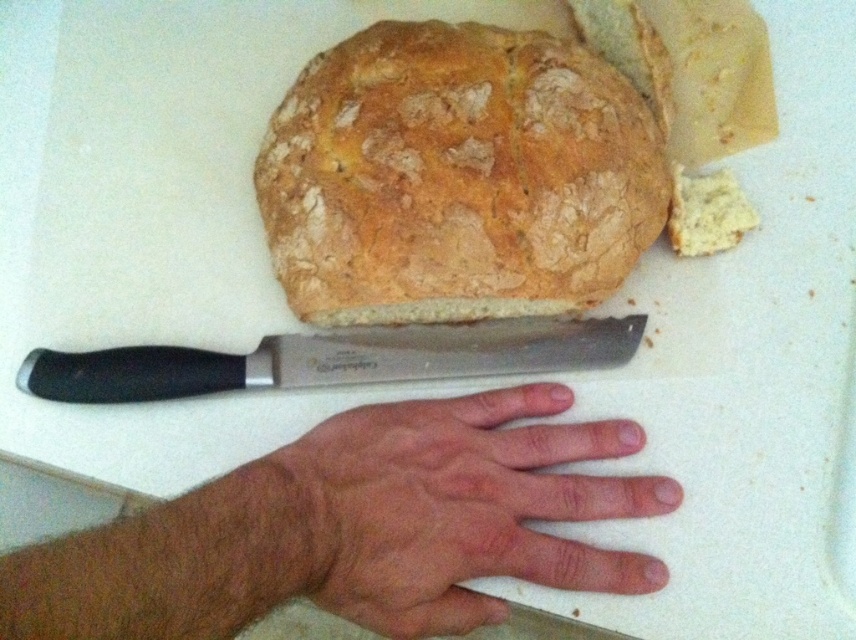
Which is behind, point (465, 182) or point (504, 326)?

Point (504, 326)

Between golden brown crusty bread at upper center and black plastic handle knife at center, which one is positioned lower?

Positioned lower is black plastic handle knife at center.

You are a GUI agent. You are given a task and a screenshot of the screen. Output one action in this format:
    pyautogui.click(x=<x>, y=<y>)
    Task: Click on the golden brown crusty bread at upper center
    
    Given the screenshot: What is the action you would take?
    pyautogui.click(x=456, y=177)

Based on the photo, does golden brown crusty bread at upper center appear on the left side of dry skin at center?

Indeed, golden brown crusty bread at upper center is positioned on the left side of dry skin at center.

Does golden brown crusty bread at upper center appear on the right side of dry skin at center?

Incorrect, golden brown crusty bread at upper center is not on the right side of dry skin at center.

What do you see at coordinates (456, 177) in the screenshot? I see `golden brown crusty bread at upper center` at bounding box center [456, 177].

You are a GUI agent. You are given a task and a screenshot of the screen. Output one action in this format:
    pyautogui.click(x=<x>, y=<y>)
    Task: Click on the golden brown crusty bread at upper center
    
    Given the screenshot: What is the action you would take?
    pyautogui.click(x=456, y=177)

Which is below, dry skin at center or black plastic handle knife at center?

dry skin at center is below.

Which is behind, point (325, 435) or point (346, 360)?

The point (346, 360) is behind.

Identify the location of dry skin at center. The height and width of the screenshot is (640, 856). (464, 508).